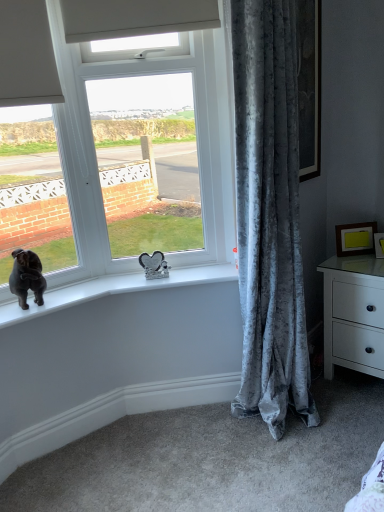
Locate an element on the screen. Image resolution: width=384 pixels, height=512 pixels. free location to the right of black velvet dog at window is located at coordinates (69, 296).